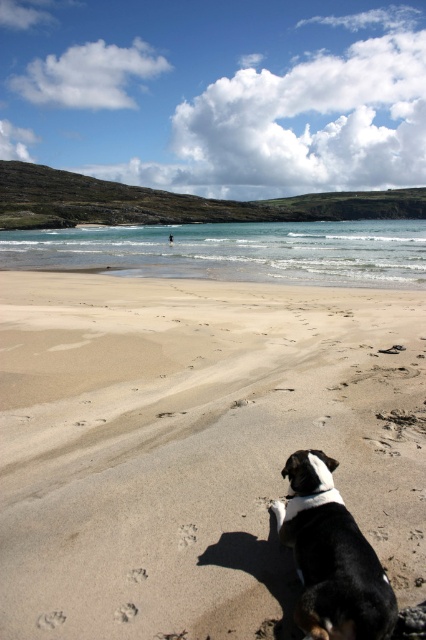
Does sandy beach at lower center have a smaller size compared to black and white fur at lower right?

No, sandy beach at lower center is not smaller than black and white fur at lower right.

Is sandy beach at lower center to the left of black and white fur at lower right from the viewer's perspective?

Yes, sandy beach at lower center is to the left of black and white fur at lower right.

Is point (236, 499) more distant than point (340, 504)?

Yes, it is behind point (340, 504).

This screenshot has width=426, height=640. I want to click on sandy beach at lower center, so click(x=193, y=445).